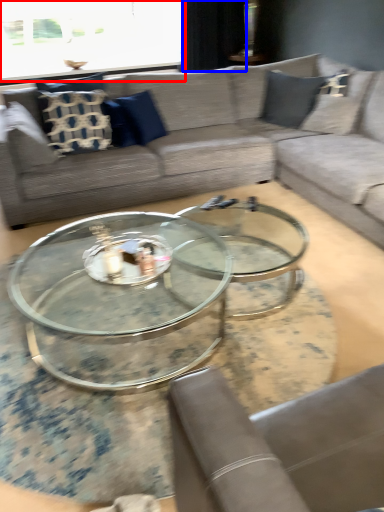
Question: Among these objects, which one is nearest to the camera, window screen (highlighted by a red box) or curtain (highlighted by a blue box)?

Choices:
 (A) window screen
 (B) curtain

Answer: (A)